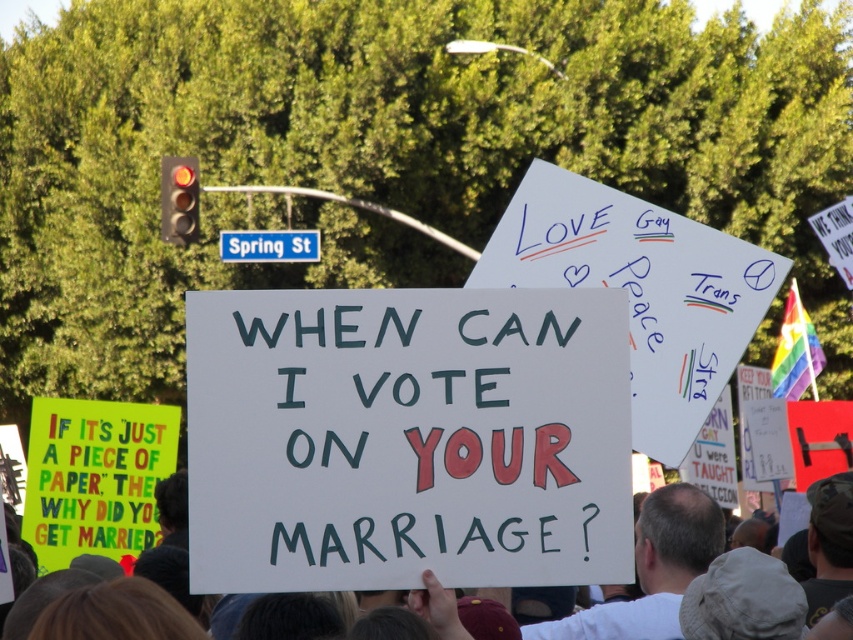
Question: Considering the relative positions of white paper sign at center and blue plastic street sign at upper center in the image provided, where is white paper sign at center located with respect to blue plastic street sign at upper center?

Choices:
 (A) below
 (B) above

Answer: (A)

Question: Which object appears farthest from the camera in this image?

Choices:
 (A) blue plastic street sign at upper center
 (B) white paper sign at center

Answer: (A)

Question: Which object appears farthest from the camera in this image?

Choices:
 (A) blue plastic street sign at upper center
 (B) white paper sign at center

Answer: (A)

Question: Is white paper sign at center below blue plastic street sign at upper center?

Choices:
 (A) yes
 (B) no

Answer: (A)

Question: Which of the following is the closest to the observer?

Choices:
 (A) (643, 547)
 (B) (312, 252)

Answer: (A)

Question: Does white paper sign at center lie behind blue plastic street sign at upper center?

Choices:
 (A) yes
 (B) no

Answer: (B)